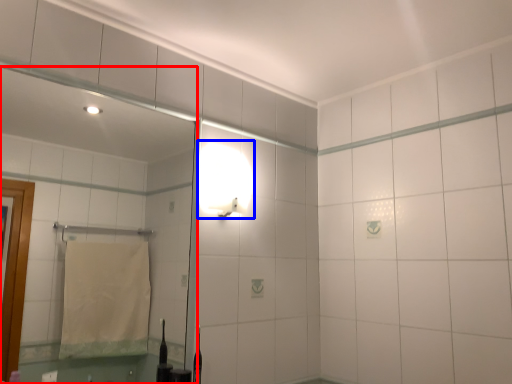
Question: Which point is closer to the camera, mirror (highlighted by a red box) or light fixture (highlighted by a blue box)?

Choices:
 (A) mirror
 (B) light fixture

Answer: (A)